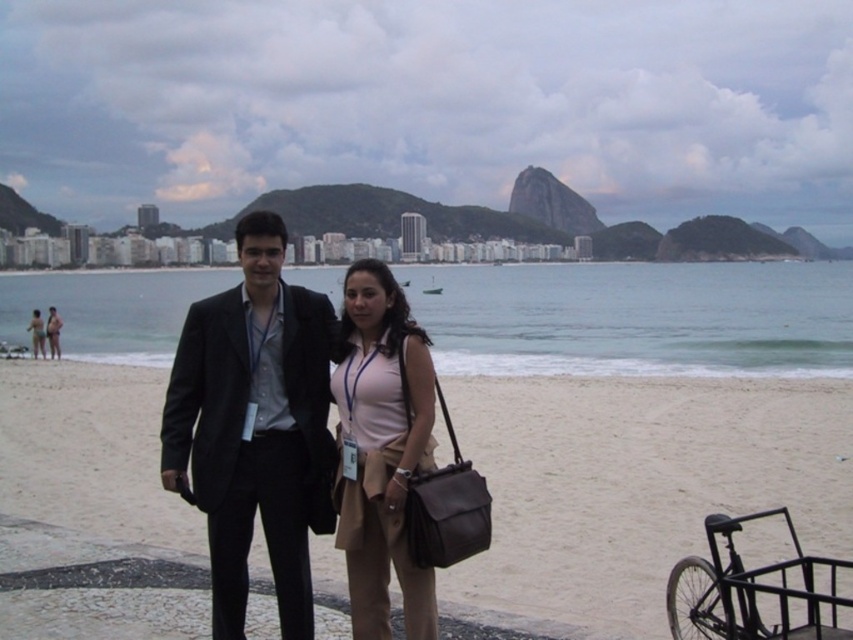
You are a photographer planning to take a group photo of the black matte suit at center and the matte black suit at center. The minimum distance required for your camera to focus properly is 60 meters. Based on the scene, will you be able to capture both subjects in focus at the same time?

The black matte suit at center and the matte black suit at center are 58.46 meters apart from each other. Since the minimum focusing distance required is 60 meters, the camera cannot capture both subjects in focus simultaneously because the distance between them is less than the required 60 meters.

You are a photographer trying to capture the beach scene. You notice the beige sand at center and the black matte suit at center. Which object would appear closer to the camera based on their heights?

The black matte suit at center would appear closer to the camera because it has a greater height than the beige sand at center.

You are standing on the beach and want to walk to both the point at coordinates point (299, 468) and point (36, 316). Which point should you visit first to minimize the total distance walked?

You should visit point (299, 468) first because it is closer to you than point (36, 316), so going there first reduces the backtracking needed.